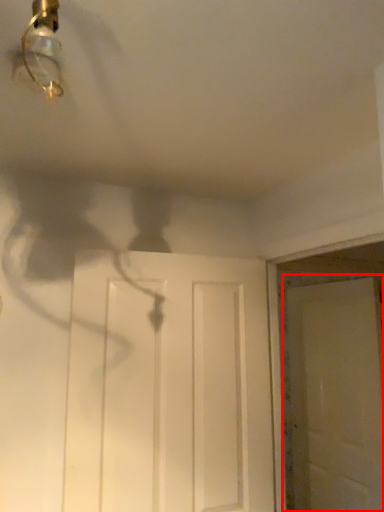
Question: Considering the relative positions of door (annotated by the red box) and door in the image provided, where is door (annotated by the red box) located with respect to the staircase?

Choices:
 (A) left
 (B) right

Answer: (B)